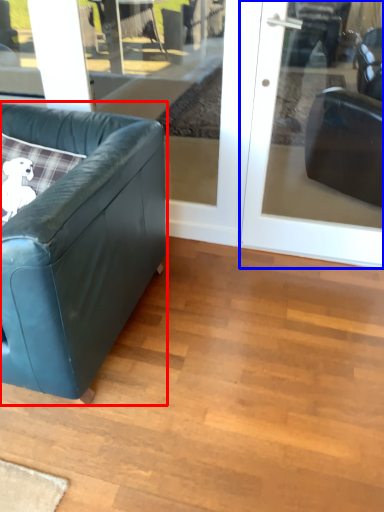
Question: Which point is closer to the camera, studio couch (highlighted by a red box) or door (highlighted by a blue box)?

Choices:
 (A) studio couch
 (B) door

Answer: (A)